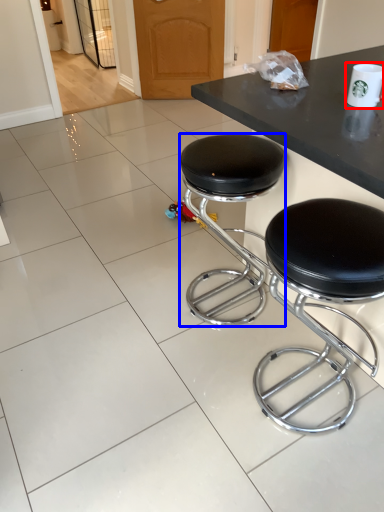
Question: Which point is closer to the camera, paper cup (highlighted by a red box) or stool (highlighted by a blue box)?

Choices:
 (A) paper cup
 (B) stool

Answer: (A)